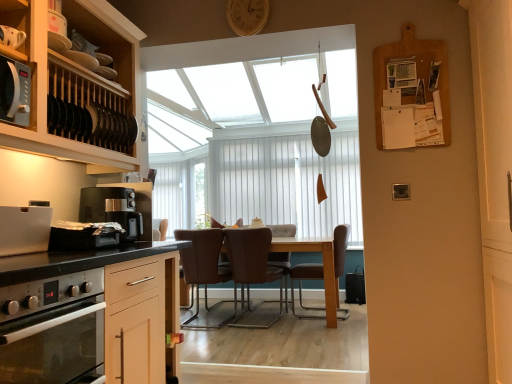
Question: From their relative heights in the image, would you say wooden clock at upper center is taller or shorter than burlap bulletin board at upper right?

Choices:
 (A) tall
 (B) short

Answer: (B)

Question: Considering the positions of wooden clock at upper center and burlap bulletin board at upper right in the image, is wooden clock at upper center wider or thinner than burlap bulletin board at upper right?

Choices:
 (A) thin
 (B) wide

Answer: (B)

Question: Estimate the real-world distances between objects in this image. Which object is farther from the brown leather swivel chair at center?

Choices:
 (A) burlap bulletin board at upper right
 (B) black plastic coffee maker at left
 (C) shiny metallic toaster at left
 (D) black glass oven at lower left
 (E) brown leather chair at center, the third chair when ordered from right to left

Answer: (D)

Question: Which object is positioned closest to the wooden clock at upper center?

Choices:
 (A) brown leather swivel chair at center
 (B) matte black plate rack at left
 (C) shiny metallic toaster at left
 (D) black glass oven at lower left
 (E) brown leather chair at center, acting as the first chair starting from the left

Answer: (B)